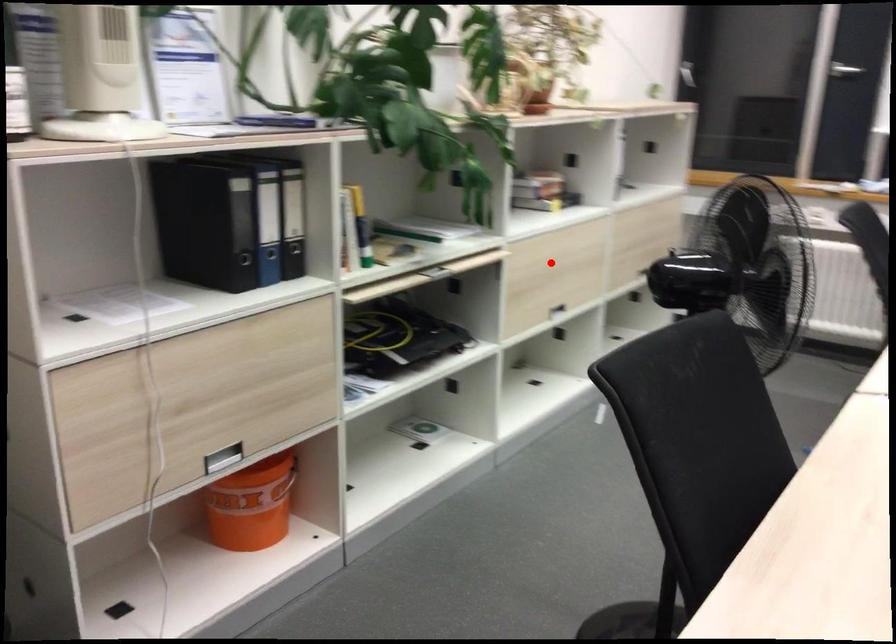
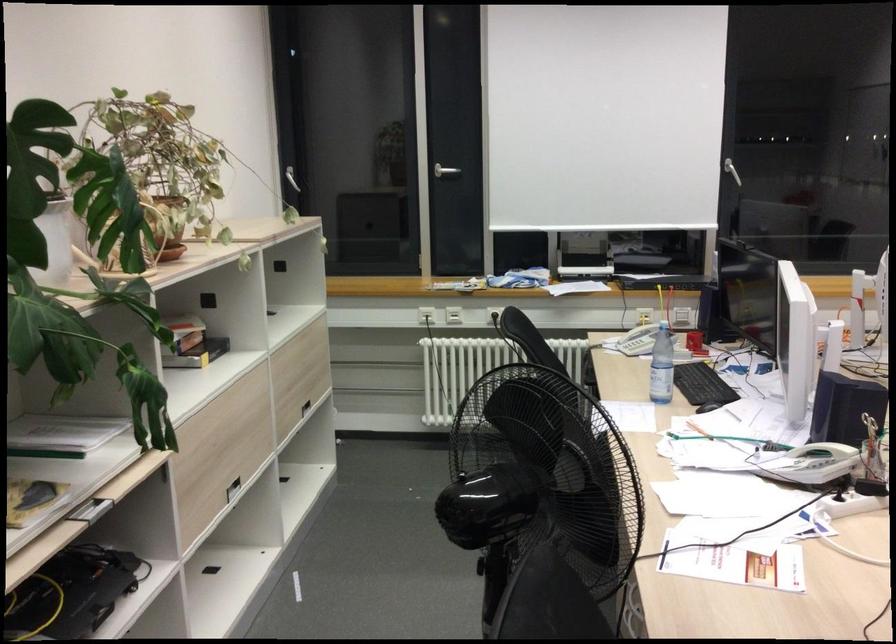
In the second image, find the point that corresponds to the highlighted location in the first image.

(225, 435)